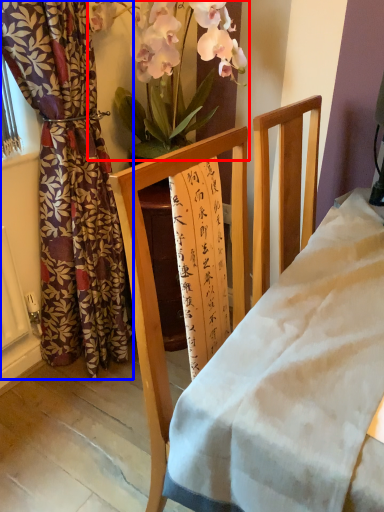
Question: Which object is further to the camera taking this photo, floral arrangement (highlighted by a red box) or curtain (highlighted by a blue box)?

Choices:
 (A) floral arrangement
 (B) curtain

Answer: (A)